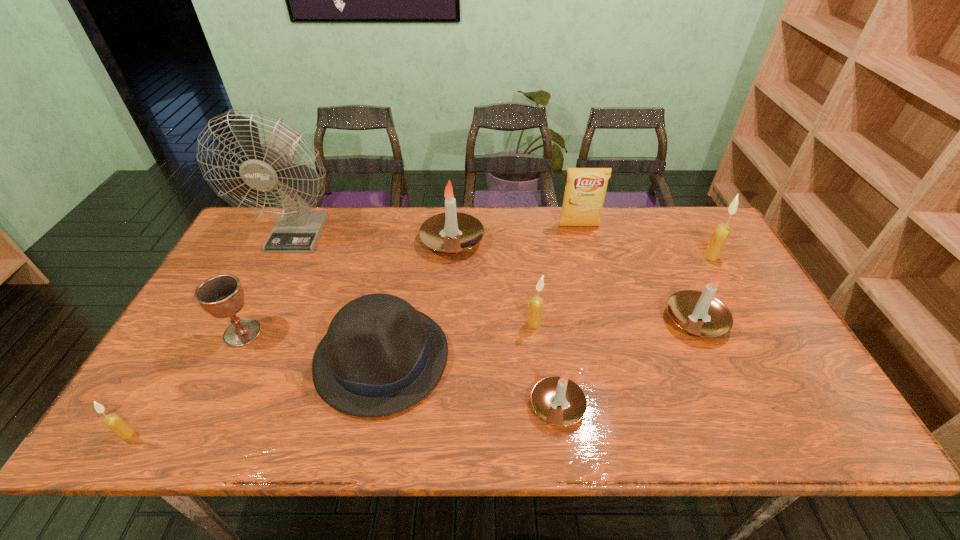
Where is `free space that satisfies the following two spatial constraints: 1. on the air flow direction of the smallest white candle; 2. on the right side of the tallest object`? This screenshot has width=960, height=540. free space that satisfies the following two spatial constraints: 1. on the air flow direction of the smallest white candle; 2. on the right side of the tallest object is located at coordinates (216, 406).